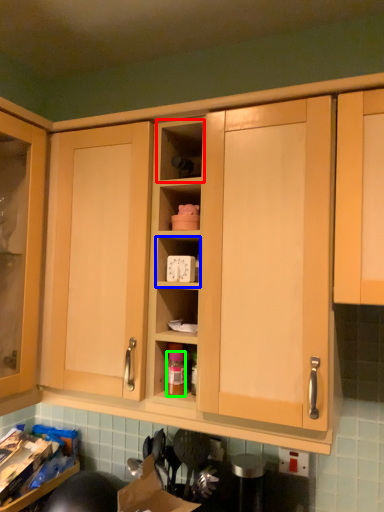
Question: Which is farther away from shelf (highlighted by a red box)? cabinet (highlighted by a blue box) or bottle (highlighted by a green box)?

Choices:
 (A) cabinet
 (B) bottle

Answer: (B)